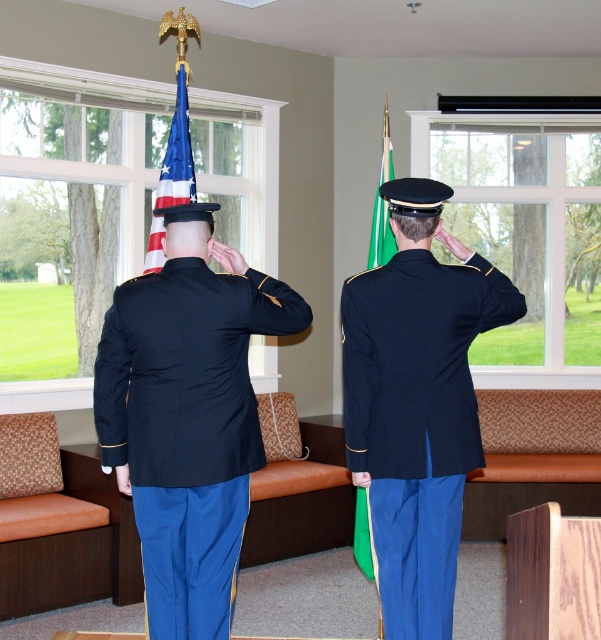
Question: Is navy blue fabric jacket at center above american flag at center?

Choices:
 (A) no
 (B) yes

Answer: (A)

Question: Which object is the farthest from the green fabric flag at center?

Choices:
 (A) navy blue fabric jacket at center
 (B) american flag at center

Answer: (A)

Question: Among these points, which one is nearest to the camera?

Choices:
 (A) (162, 204)
 (B) (160, 444)
 (C) (397, 371)

Answer: (B)

Question: Can you confirm if matte black jacket at center is positioned to the left of american flag at center?

Choices:
 (A) yes
 (B) no

Answer: (B)

Question: Which of the following is the farthest from the observer?

Choices:
 (A) (160, 220)
 (B) (275, 324)

Answer: (A)

Question: Where is matte black jacket at center located in relation to green fabric flag at center in the image?

Choices:
 (A) left
 (B) right

Answer: (A)